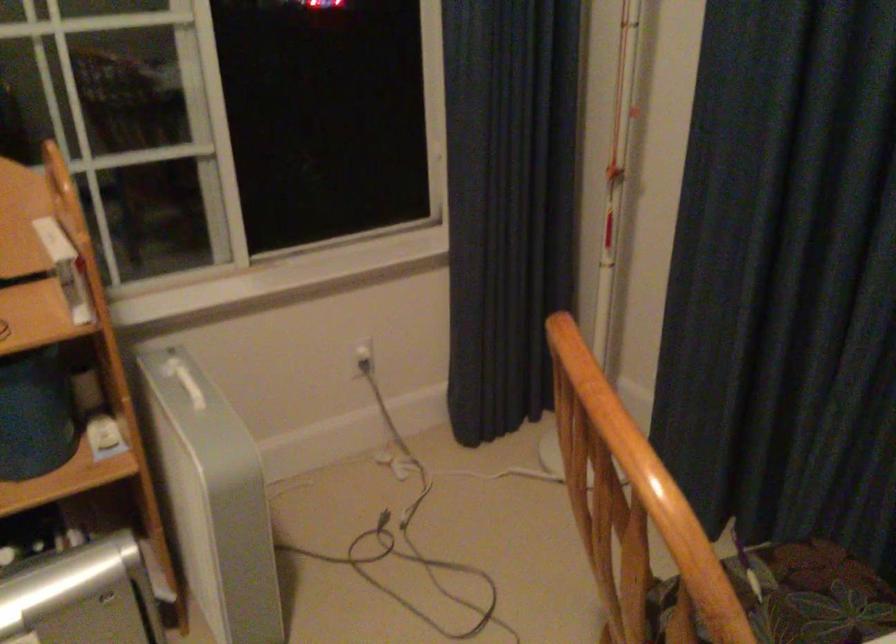
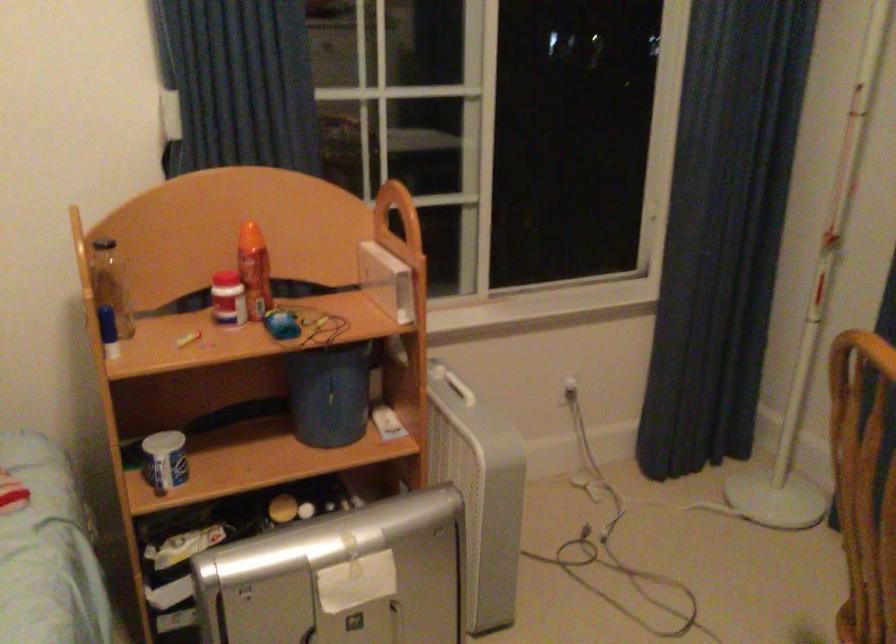
The point at (591, 504) is marked in the first image. Where is the corresponding point in the second image?

(864, 484)